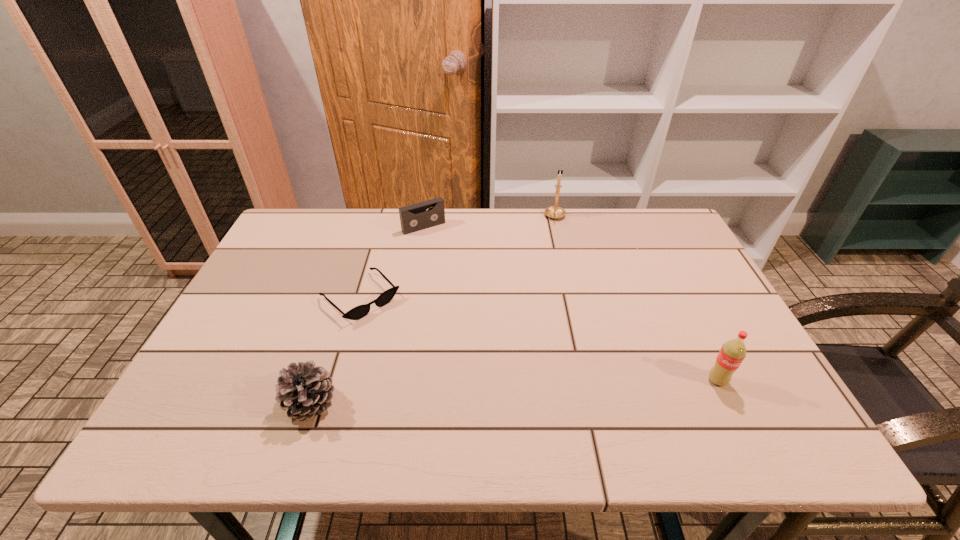
This screenshot has width=960, height=540. What are the coordinates of `object identified as the closest to the sunglasses` in the screenshot? It's located at (304, 390).

The image size is (960, 540). I want to click on object that is the second closest one to the second shortest object, so click(555, 212).

What are the coordinates of `free space that satisfies the following two spatial constraints: 1. on the front side of the soda; 2. on the left side of the candle holder` in the screenshot? It's located at [x=593, y=380].

This screenshot has width=960, height=540. In order to click on free space that satisfies the following two spatial constraints: 1. on the back side of the videotape; 2. on the right side of the third tallest object in this screenshot , I will do `click(369, 227)`.

Where is `free point that satisfies the following two spatial constraints: 1. on the front side of the soda; 2. on the right side of the fourth tallest object`? free point that satisfies the following two spatial constraints: 1. on the front side of the soda; 2. on the right side of the fourth tallest object is located at coordinates (398, 380).

What are the coordinates of `vacant point that satisfies the following two spatial constraints: 1. on the back side of the shortest object; 2. on the left side of the videotape` in the screenshot? It's located at (381, 227).